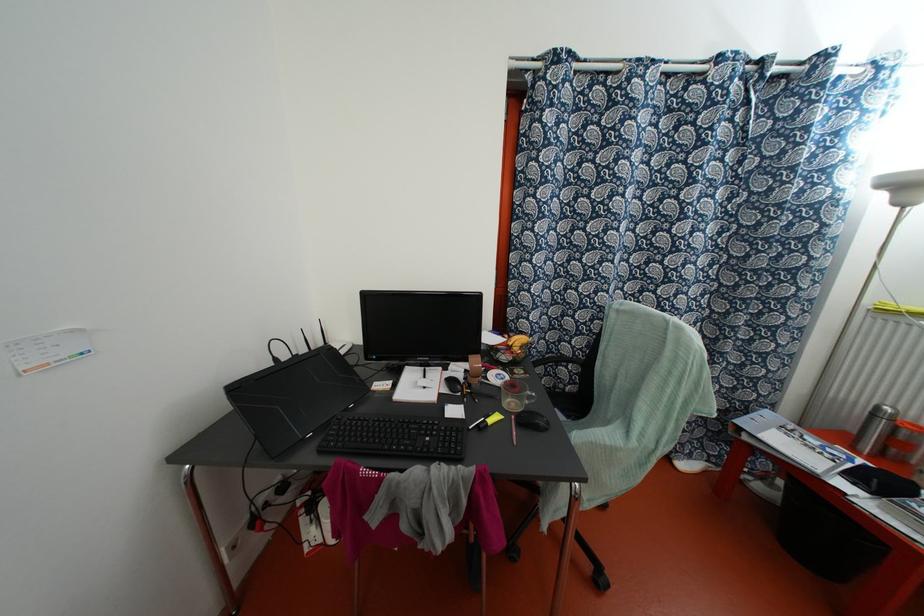
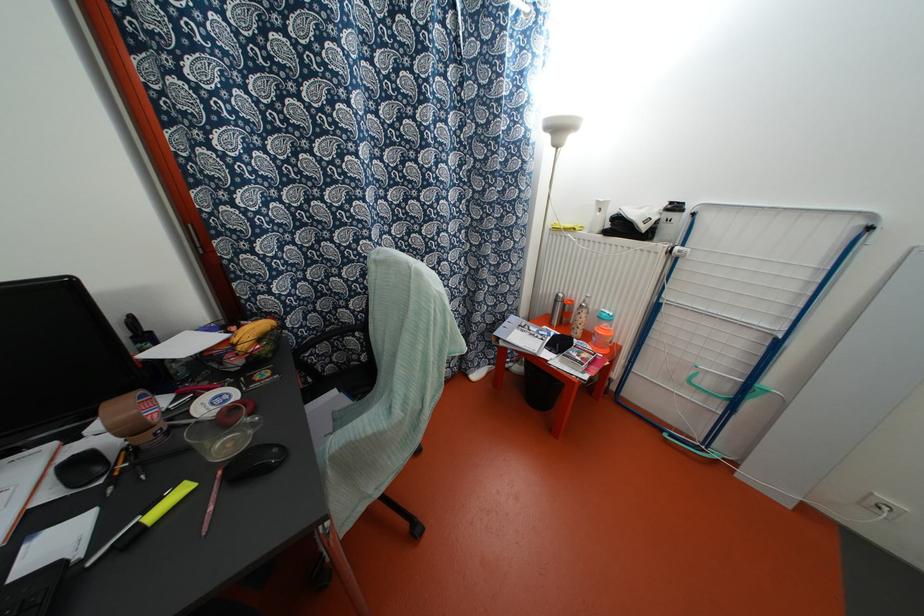
Find the pixel in the second image that matches (x=489, y=421) in the first image.

(152, 515)